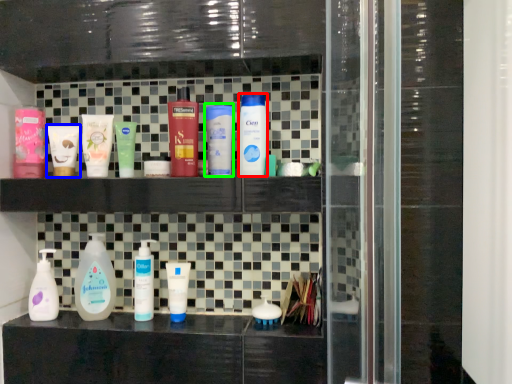
Question: Estimate the real-world distances between objects in this image. Which object is farther from cleaning product (highlighted by a red box), toiletry (highlighted by a blue box) or toiletry (highlighted by a green box)?

Choices:
 (A) toiletry
 (B) toiletry

Answer: (A)